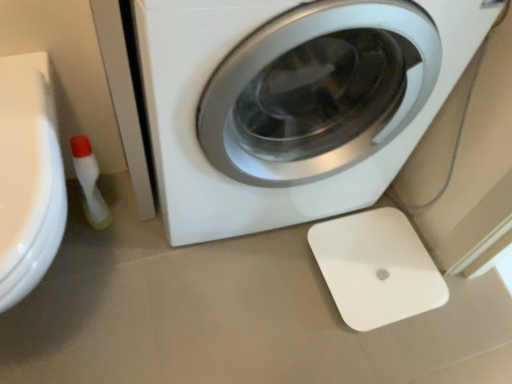
Where is `vacant space underneath white plastic scale at lower right (from a real-world perspective)`? The height and width of the screenshot is (384, 512). vacant space underneath white plastic scale at lower right (from a real-world perspective) is located at coordinates (375, 265).